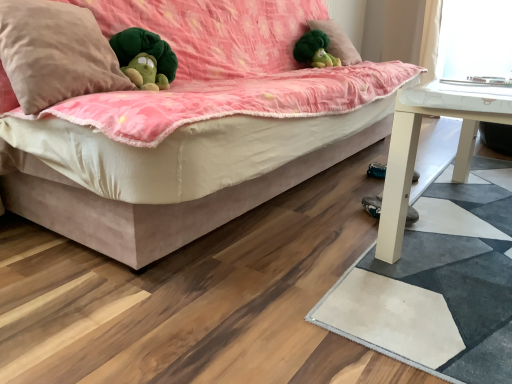
Locate an element on the screen. The height and width of the screenshot is (384, 512). free point to the right of black suede shoe at lower right is located at coordinates point(446,216).